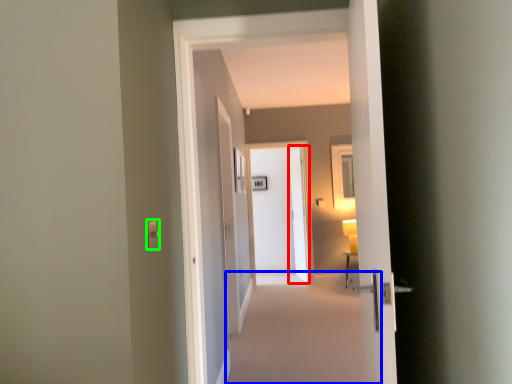
Question: Estimate the real-world distances between objects in this image. Which object is closer to screen door (highlighted by a red box), plain (highlighted by a blue box) or light switch (highlighted by a green box)?

Choices:
 (A) plain
 (B) light switch

Answer: (A)